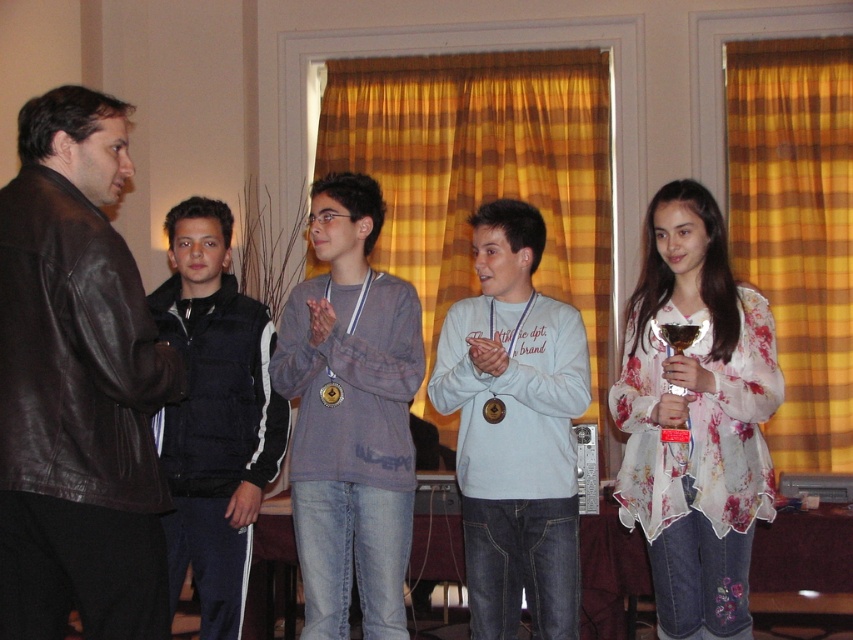
You are standing at the camera position and want to reach the point marked as point (137,584). If your walking speed is 1.5 meters per second, how long will it take you to reach that point?

The distance between the camera and point (137,584) is 2.27 meters. At a speed of 1.5 meters per second, it would take approximately 1.5 seconds to reach the point.

You are standing at the position of the light blue cotton shirt at center and want to hand a document to the person wearing the brown leather jacket at left. Can you reach them without moving from your current position if your arm can extend 3 feet?

The brown leather jacket at left is 3.98 feet away from the light blue cotton shirt at center. Since your arm can only extend 3 feet, you cannot reach them without moving.